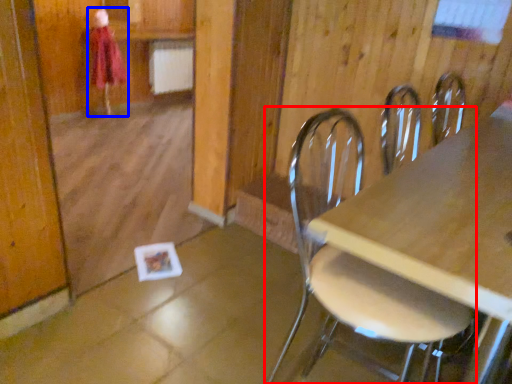
Question: Which object is further to the camera taking this photo, chair (highlighted by a red box) or person (highlighted by a blue box)?

Choices:
 (A) chair
 (B) person

Answer: (B)